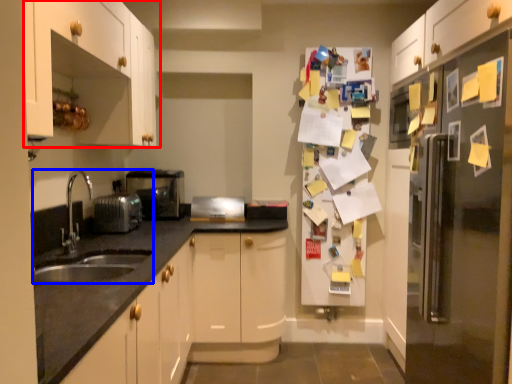
Question: Which point is closer to the camera, cabinetry (highlighted by a red box) or sink (highlighted by a blue box)?

Choices:
 (A) cabinetry
 (B) sink

Answer: (A)